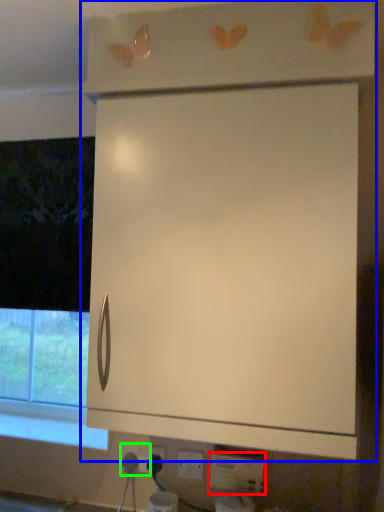
Question: Which object is positioned closest to electric outlet (highlighted by a red box)? Select from cabinetry (highlighted by a blue box) and electric outlet (highlighted by a green box).

Choices:
 (A) cabinetry
 (B) electric outlet

Answer: (B)